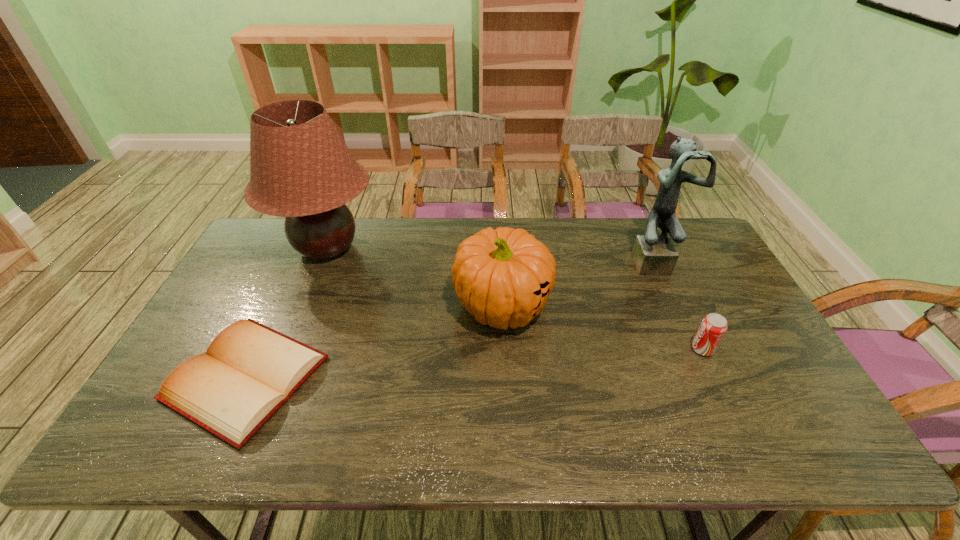
Locate an element on the screen. This screenshot has width=960, height=540. object at the far left corner is located at coordinates (300, 168).

Locate an element on the screen. The image size is (960, 540). object located at the near left corner is located at coordinates (249, 371).

Locate an element on the screen. This screenshot has width=960, height=540. object present at the far right corner is located at coordinates (653, 254).

In the image, there is a desktop. At what (x,y) coordinates should I click in order to perform the action: click on vacant region at the far edge. Please return your answer as a coordinate pair (x, y). Looking at the image, I should click on (365, 238).

Locate an element on the screen. blank area at the near edge is located at coordinates (272, 424).

Image resolution: width=960 pixels, height=540 pixels. In the image, there is a desktop. Find the location of `free region at the right edge`. free region at the right edge is located at coordinates (700, 289).

Identify the location of vacant space at the near right corner of the desktop. (765, 429).

Identify the location of vacant point located between the lampshade and the pumpkin. This screenshot has height=540, width=960. (415, 277).

The image size is (960, 540). Identify the location of free space between the soda can and the shortest object. (474, 363).

The height and width of the screenshot is (540, 960). I want to click on vacant area that lies between the third object from left to right and the sculpture, so click(578, 284).